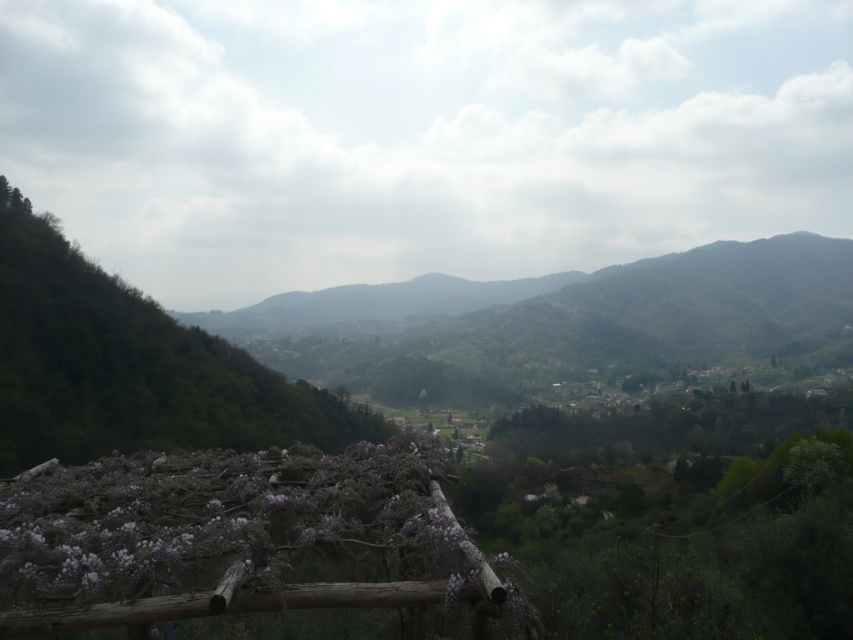
Who is taller, purple wood trellis at lower left or green leafy mountain at center?

green leafy mountain at center is taller.

Is purple wood trellis at lower left thinner than green leafy mountain at center?

Correct, purple wood trellis at lower left's width is less than green leafy mountain at center's.

The height and width of the screenshot is (640, 853). I want to click on purple wood trellis at lower left, so click(x=247, y=547).

Can you confirm if green leafy mountain at center is thinner than green leafy tree at left?

No, green leafy mountain at center is not thinner than green leafy tree at left.

Does green leafy mountain at center come behind green leafy tree at left?

Yes, it is behind green leafy tree at left.

Is point (416, 392) farther from viewer compared to point (318, 396)?

Yes, point (416, 392) is behind point (318, 396).

Locate an element on the screen. This screenshot has height=640, width=853. green leafy mountain at center is located at coordinates (558, 321).

Is point (486, 582) behind point (122, 321)?

That is False.

How distant is purple wood trellis at lower left from green leafy tree at left?

687.31 feet

The height and width of the screenshot is (640, 853). What do you see at coordinates (247, 547) in the screenshot?
I see `purple wood trellis at lower left` at bounding box center [247, 547].

Image resolution: width=853 pixels, height=640 pixels. In order to click on purple wood trellis at lower left in this screenshot , I will do `click(247, 547)`.